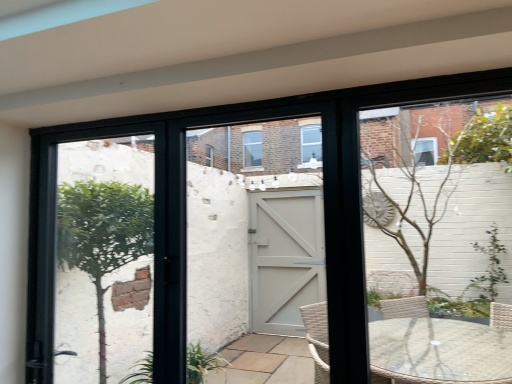
Measure the distance between point (305, 136) and camera.

1.60 meters.

Find the location of a particular element. This screenshot has width=512, height=384. matte black glass door at center is located at coordinates (253, 229).

The height and width of the screenshot is (384, 512). What do you see at coordinates (253, 229) in the screenshot? I see `matte black glass door at center` at bounding box center [253, 229].

At what (x,y) coordinates should I click in order to perform the action: click on matte black glass door at center. Please return your answer as a coordinate pair (x, y). This screenshot has height=384, width=512. Looking at the image, I should click on (253, 229).